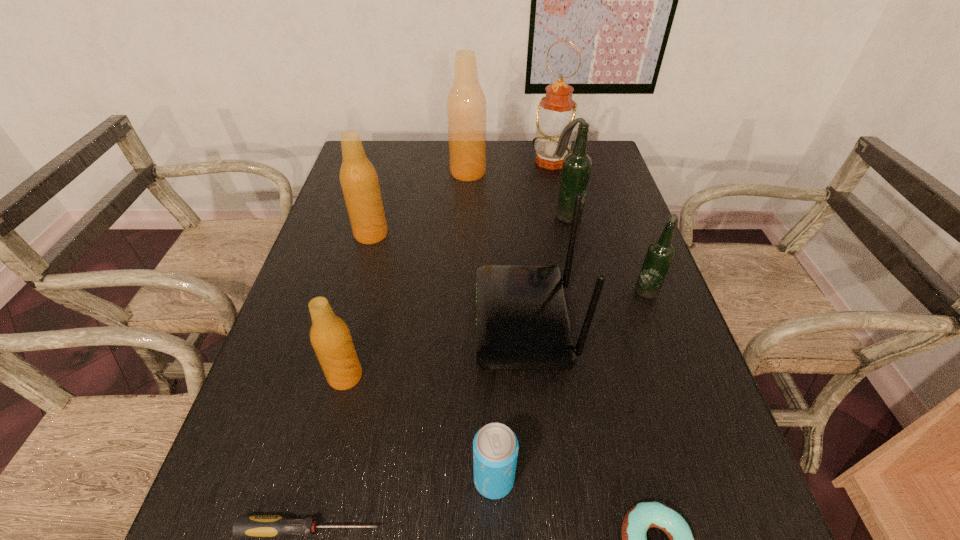
Locate an element on the screen. vacant space situated 0.140m on the left of the fourth farthest beer bottle is located at coordinates (577, 289).

At what (x,y) coordinates should I click in order to perform the action: click on free space located 0.200m on the back of the smallest tan beer bottle. Please return your answer as a coordinate pair (x, y). Looking at the image, I should click on (366, 293).

What are the coordinates of `free space located on the left of the third nearest object` in the screenshot? It's located at (272, 479).

The image size is (960, 540). Find the location of `oil lamp that is positioned at the far edge`. oil lamp that is positioned at the far edge is located at coordinates (557, 109).

The height and width of the screenshot is (540, 960). What are the coordinates of `beer bottle that is at the far edge` in the screenshot? It's located at (466, 105).

In order to click on oil lamp located in the right edge section of the desktop in this screenshot , I will do `click(557, 109)`.

At what (x,y) coordinates should I click in order to perform the action: click on object that is at the far right corner. Please return your answer as a coordinate pair (x, y). This screenshot has width=960, height=540. Looking at the image, I should click on (557, 109).

The height and width of the screenshot is (540, 960). What are the coordinates of `free space at the far edge` in the screenshot? It's located at (423, 168).

Identify the location of vacant region at the left edge. (299, 357).

You are a GUI agent. You are given a task and a screenshot of the screen. Output one action in this format:
    pyautogui.click(x=<x>, y=<y>)
    Task: Click on the free spot at the right edge of the desktop
    This screenshot has width=960, height=540.
    Given the screenshot: What is the action you would take?
    pyautogui.click(x=666, y=338)